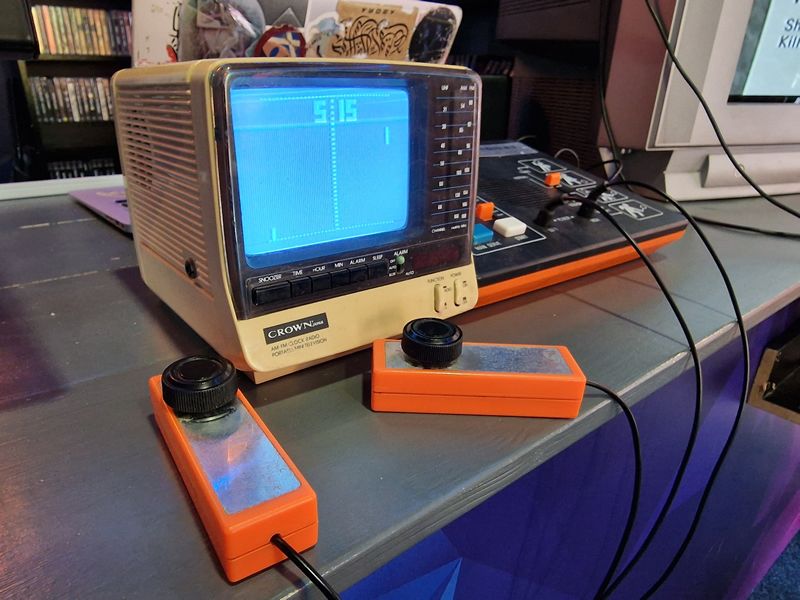
Find the location of a particular element. desk top is located at coordinates (401, 473).